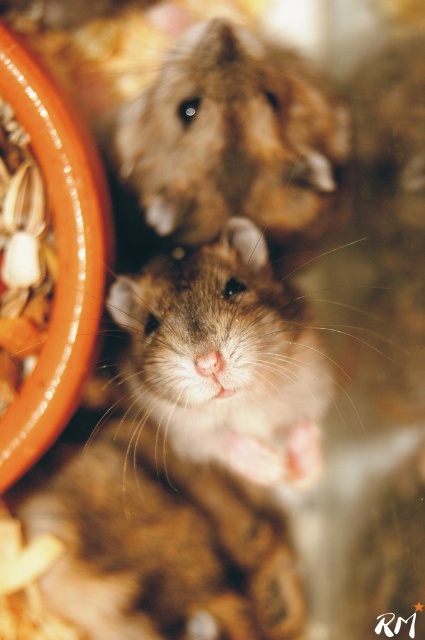
From the picture: Can you confirm if fuzzy brown hamster at center is positioned below fuzzy brown hamster at upper center?

Correct, fuzzy brown hamster at center is located below fuzzy brown hamster at upper center.

Who is taller, fuzzy brown hamster at center or fuzzy brown hamster at upper center?

fuzzy brown hamster at center is taller.

Who is more forward, (189, 349) or (337, 104)?

Positioned in front is point (189, 349).

At what (x,y) coordinates should I click in order to perform the action: click on fuzzy brown hamster at center. Please return your answer as a coordinate pair (x, y). The width and height of the screenshot is (425, 640). Looking at the image, I should click on (226, 358).